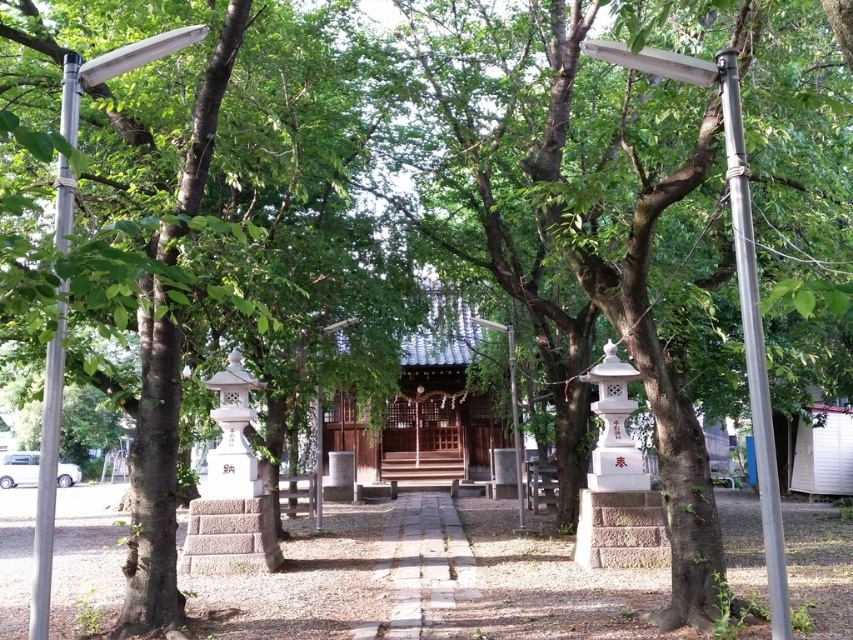
Can you confirm if metallic silver pole at upper center is smaller than metallic silver pole at left?

Answer: Yes, metallic silver pole at upper center is smaller than metallic silver pole at left.

Is point (679, 54) positioned in front of point (97, 64)?

No, it is behind (97, 64).

Identify the location of metallic silver pole at upper center. This screenshot has height=640, width=853. (737, 284).

Who is more forward, (62, 336) or (520, 483)?

Point (62, 336)

In the scene shown: Is metallic silver pole at left below metallic pole at center?

No, metallic silver pole at left is not below metallic pole at center.

Locate an element on the screen. This screenshot has width=853, height=640. metallic silver pole at left is located at coordinates (47, 476).

Does brown wooden hut at center appear over metallic silver pole at left?

Correct, brown wooden hut at center is located above metallic silver pole at left.

Who is positioned more to the right, brown wooden hut at center or metallic silver pole at left?

brown wooden hut at center

Between point (357, 449) and point (42, 452), which one is positioned in front?

Positioned in front is point (42, 452).

Identify the location of brown wooden hut at center. (425, 410).